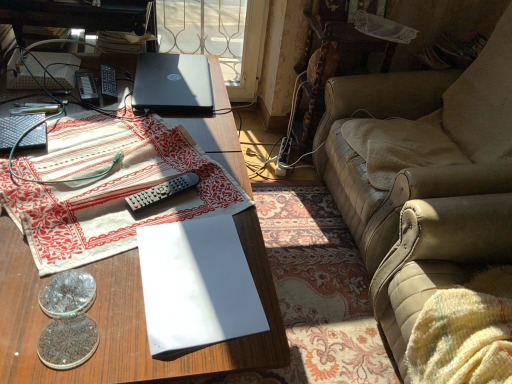
Image resolution: width=512 pixels, height=384 pixels. Find the location of `vacant space behind black plastic remote control at center, which appears as the first remote control when viewed from the back`. vacant space behind black plastic remote control at center, which appears as the first remote control when viewed from the back is located at coordinates pyautogui.click(x=133, y=71).